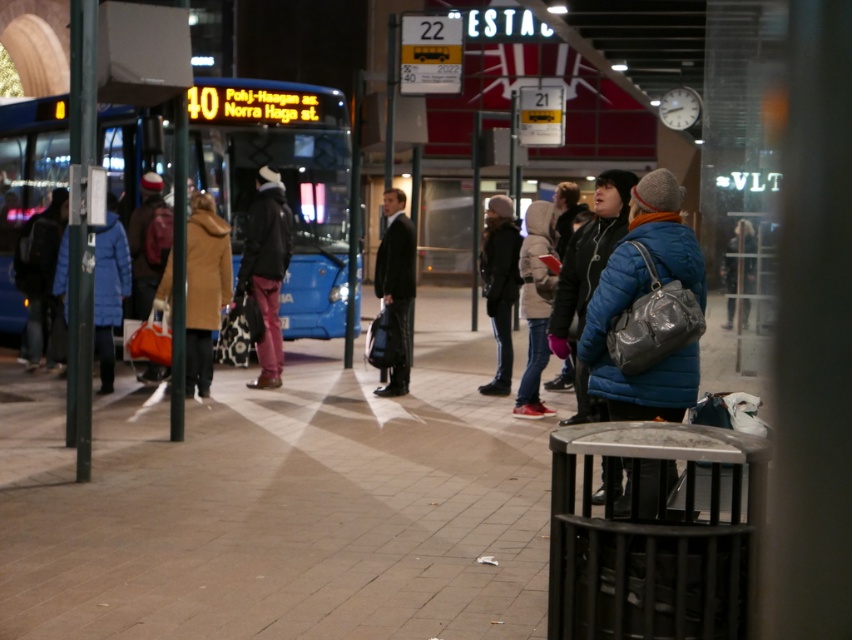
Which is more to the left, blue matte bus at left or brown wool coat at center?

blue matte bus at left is more to the left.

Identify the location of blue matte bus at left. This screenshot has height=640, width=852. (286, 180).

Does point (324, 252) come in front of point (186, 280)?

No, (324, 252) is further to viewer.

At what (x,y) coordinates should I click in order to perform the action: click on blue matte bus at left. Please return your answer as a coordinate pair (x, y). The image size is (852, 640). Looking at the image, I should click on (286, 180).

Who is positioned more to the left, white fuzzy coat at center or dark blue jeans at center?

Positioned to the left is dark blue jeans at center.

Does white fuzzy coat at center have a greater width compared to dark blue jeans at center?

Yes.

The width and height of the screenshot is (852, 640). In order to click on white fuzzy coat at center in this screenshot , I will do `click(534, 305)`.

Where is `white fuzzy coat at center`? Image resolution: width=852 pixels, height=640 pixels. white fuzzy coat at center is located at coordinates (534, 305).

How far apart are blue matte bus at left and black metal trash can at lower right?

blue matte bus at left and black metal trash can at lower right are 12.48 meters apart.

What do you see at coordinates (286, 180) in the screenshot?
I see `blue matte bus at left` at bounding box center [286, 180].

Between point (229, 141) and point (714, 634), which one is positioned in front?

Positioned in front is point (714, 634).

The width and height of the screenshot is (852, 640). What are the coordinates of `blue matte bus at left` in the screenshot? It's located at (286, 180).